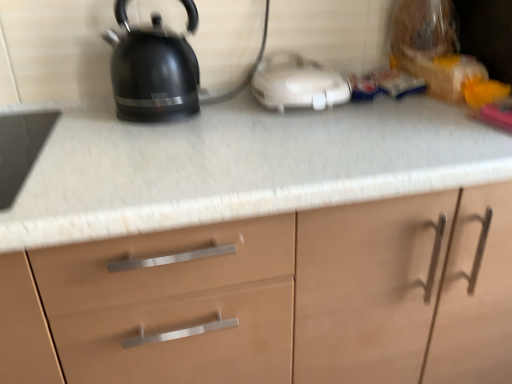
Where is `free space in front of black glossy kettle at upper left`? free space in front of black glossy kettle at upper left is located at coordinates (142, 140).